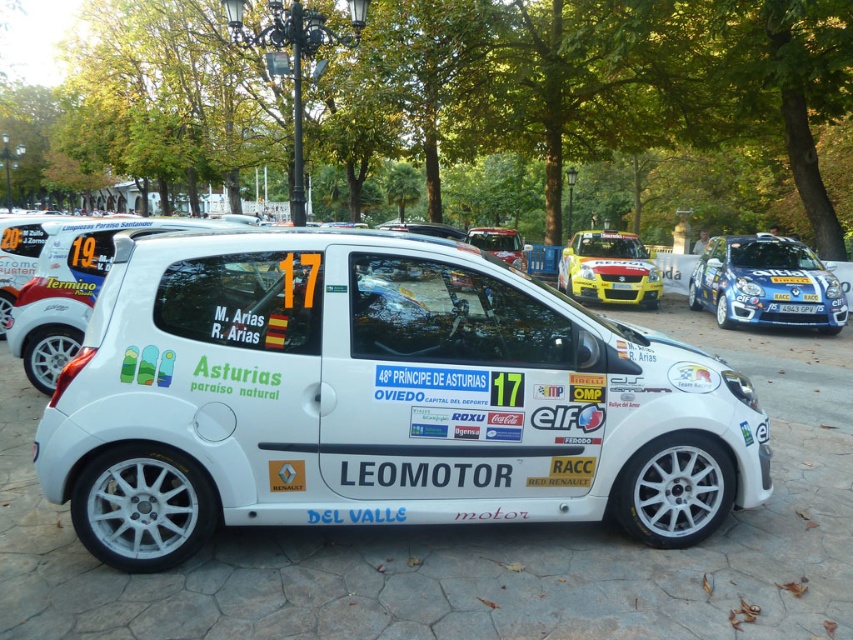
Based on the photo, is white matte rally car at center positioned behind white plastic license plate at center?

No, white matte rally car at center is closer to the viewer.

Which is in front, point (621, 417) or point (799, 308)?

Point (621, 417) is more forward.

Locate an element on the screen. white matte rally car at center is located at coordinates (376, 400).

Is white matte car at center taller than white plastic license plate at center?

Correct, white matte car at center is much taller as white plastic license plate at center.

Which is behind, point (498, 227) or point (799, 308)?

The point (498, 227) is behind.

At what (x,y) coordinates should I click in order to perform the action: click on white matte car at center. Please return your answer as a coordinate pair (x, y). The width and height of the screenshot is (853, 640). Looking at the image, I should click on (498, 243).

Who is shorter, blue metallic hatchback at upper right or white plastic license plate at center?

With less height is white plastic license plate at center.

Does blue metallic hatchback at upper right lie in front of white plastic license plate at center?

No, blue metallic hatchback at upper right is further to the viewer.

At what (x,y) coordinates should I click in order to perform the action: click on blue metallic hatchback at upper right. Please return your answer as a coordinate pair (x, y). Looking at the image, I should click on (764, 284).